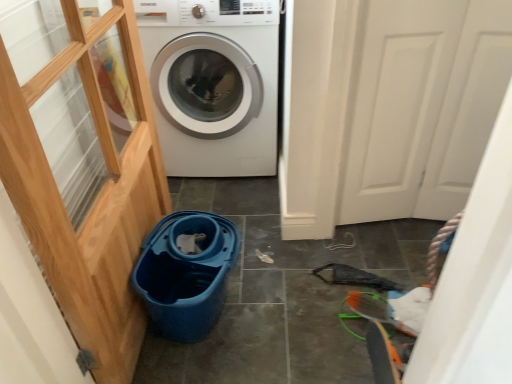
Question: Does white glossy washing machine at center have a larger size compared to blue plastic bucket at lower center?

Choices:
 (A) yes
 (B) no

Answer: (A)

Question: Does white glossy washing machine at center come in front of blue plastic bucket at lower center?

Choices:
 (A) yes
 (B) no

Answer: (B)

Question: Considering the relative sizes of white glossy washing machine at center and blue plastic bucket at lower center in the image provided, is white glossy washing machine at center smaller than blue plastic bucket at lower center?

Choices:
 (A) no
 (B) yes

Answer: (A)

Question: From the image's perspective, is white glossy washing machine at center located above blue plastic bucket at lower center?

Choices:
 (A) yes
 (B) no

Answer: (A)

Question: Does white glossy washing machine at center contain blue plastic bucket at lower center?

Choices:
 (A) yes
 (B) no

Answer: (B)

Question: Can you confirm if white glossy washing machine at center is shorter than blue plastic bucket at lower center?

Choices:
 (A) no
 (B) yes

Answer: (A)

Question: Can you confirm if white glossy washing machine at center is bigger than white matte door at right?

Choices:
 (A) no
 (B) yes

Answer: (B)

Question: From the image's perspective, would you say white glossy washing machine at center is shown under white matte door at right?

Choices:
 (A) yes
 (B) no

Answer: (B)

Question: From a real-world perspective, is white glossy washing machine at center located higher than white matte door at right?

Choices:
 (A) yes
 (B) no

Answer: (B)

Question: Does white glossy washing machine at center appear on the left side of white matte door at right?

Choices:
 (A) yes
 (B) no

Answer: (A)

Question: Is white glossy washing machine at center not within white matte door at right?

Choices:
 (A) no
 (B) yes

Answer: (B)

Question: Is white glossy washing machine at center oriented towards white matte door at right?

Choices:
 (A) no
 (B) yes

Answer: (A)

Question: From the image's perspective, is white matte door at right below white glossy washing machine at center?

Choices:
 (A) no
 (B) yes

Answer: (B)